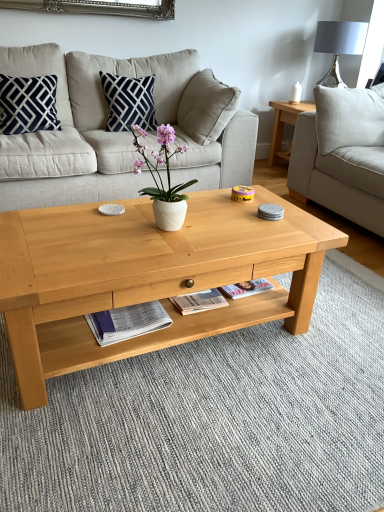
Question: Is matte gray lampshade at upper right to the left of white matte vase at center from the viewer's perspective?

Choices:
 (A) yes
 (B) no

Answer: (B)

Question: Considering the relative sizes of matte gray lampshade at upper right and white matte vase at center in the image provided, is matte gray lampshade at upper right shorter than white matte vase at center?

Choices:
 (A) no
 (B) yes

Answer: (A)

Question: Is matte gray lampshade at upper right wider than white matte vase at center?

Choices:
 (A) yes
 (B) no

Answer: (A)

Question: Is matte gray lampshade at upper right looking in the opposite direction of white matte vase at center?

Choices:
 (A) yes
 (B) no

Answer: (B)

Question: Is matte gray lampshade at upper right next to white matte vase at center and touching it?

Choices:
 (A) yes
 (B) no

Answer: (B)

Question: From the image's perspective, is matte gray lampshade at upper right on top of white matte vase at center?

Choices:
 (A) no
 (B) yes

Answer: (B)

Question: Can you confirm if white matte vase at center is wider than navy blue velvet pillow at upper left, which is counted as the 1th pillow, starting from the left?

Choices:
 (A) no
 (B) yes

Answer: (A)

Question: Is white matte vase at center turned away from navy blue velvet pillow at upper left, marked as the second pillow in a right-to-left arrangement?

Choices:
 (A) no
 (B) yes

Answer: (A)

Question: Considering the relative positions of white matte vase at center and navy blue velvet pillow at upper left, marked as the second pillow in a right-to-left arrangement, in the image provided, is white matte vase at center to the left of navy blue velvet pillow at upper left, marked as the second pillow in a right-to-left arrangement, from the viewer's perspective?

Choices:
 (A) no
 (B) yes

Answer: (A)

Question: Is white matte vase at center next to navy blue velvet pillow at upper left, which is counted as the 1th pillow, starting from the left?

Choices:
 (A) yes
 (B) no

Answer: (B)

Question: Can you confirm if white matte vase at center is positioned to the right of navy blue velvet pillow at upper left, marked as the second pillow in a right-to-left arrangement?

Choices:
 (A) no
 (B) yes

Answer: (B)

Question: Is the depth of white matte vase at center greater than that of navy blue velvet pillow at upper left, which is counted as the 1th pillow, starting from the left?

Choices:
 (A) no
 (B) yes

Answer: (A)

Question: Could white glossy magazine at lower center be considered to be inside navy blue fabric pillow at upper center, which ranks as the 2th pillow in left-to-right order?

Choices:
 (A) no
 (B) yes

Answer: (A)